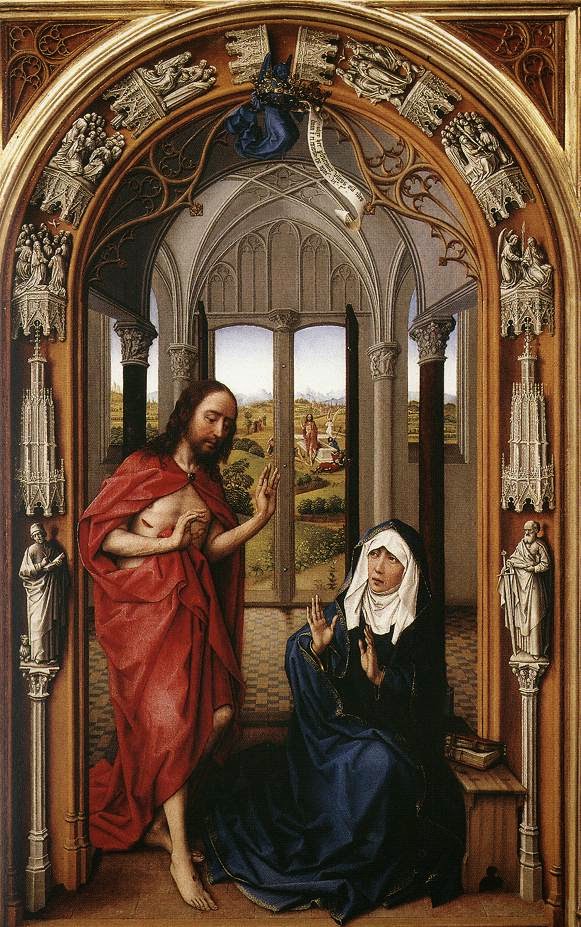
You are a GUI agent. You are given a task and a screenshot of the screen. Output one action in this format:
    pyautogui.click(x=<x>, y=<y>)
    Task: Click on the dark brown leather-bound book
    
    Given the screenshot: What is the action you would take?
    pyautogui.click(x=486, y=743)